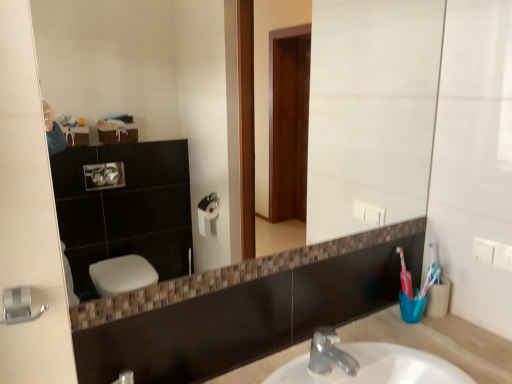
Question: Is matte glass mirror at center next to beige marble sink at center?

Choices:
 (A) yes
 (B) no

Answer: (B)

Question: Is matte glass mirror at center positioned with its back to beige marble sink at center?

Choices:
 (A) no
 (B) yes

Answer: (A)

Question: Are matte glass mirror at center and beige marble sink at center located far from each other?

Choices:
 (A) yes
 (B) no

Answer: (B)

Question: From the image's perspective, does matte glass mirror at center appear higher than beige marble sink at center?

Choices:
 (A) yes
 (B) no

Answer: (A)

Question: Does matte glass mirror at center come behind beige marble sink at center?

Choices:
 (A) yes
 (B) no

Answer: (B)

Question: Is beige marble sink at center completely or partially inside matte glass mirror at center?

Choices:
 (A) yes
 (B) no

Answer: (B)

Question: Can you confirm if beige marble sink at center is thinner than matte glass mirror at center?

Choices:
 (A) yes
 (B) no

Answer: (B)

Question: From a real-world perspective, is beige marble sink at center positioned over matte glass mirror at center based on gravity?

Choices:
 (A) no
 (B) yes

Answer: (A)

Question: Does beige marble sink at center lie behind matte glass mirror at center?

Choices:
 (A) yes
 (B) no

Answer: (A)

Question: Is matte glass mirror at center located within beige marble sink at center?

Choices:
 (A) yes
 (B) no

Answer: (B)

Question: From a real-world perspective, does beige marble sink at center sit lower than matte glass mirror at center?

Choices:
 (A) no
 (B) yes

Answer: (B)

Question: Considering the relative sizes of beige marble sink at center and matte glass mirror at center in the image provided, is beige marble sink at center taller than matte glass mirror at center?

Choices:
 (A) no
 (B) yes

Answer: (A)

Question: From their relative heights in the image, would you say beige marble sink at center is taller or shorter than matte glass mirror at center?

Choices:
 (A) tall
 (B) short

Answer: (B)